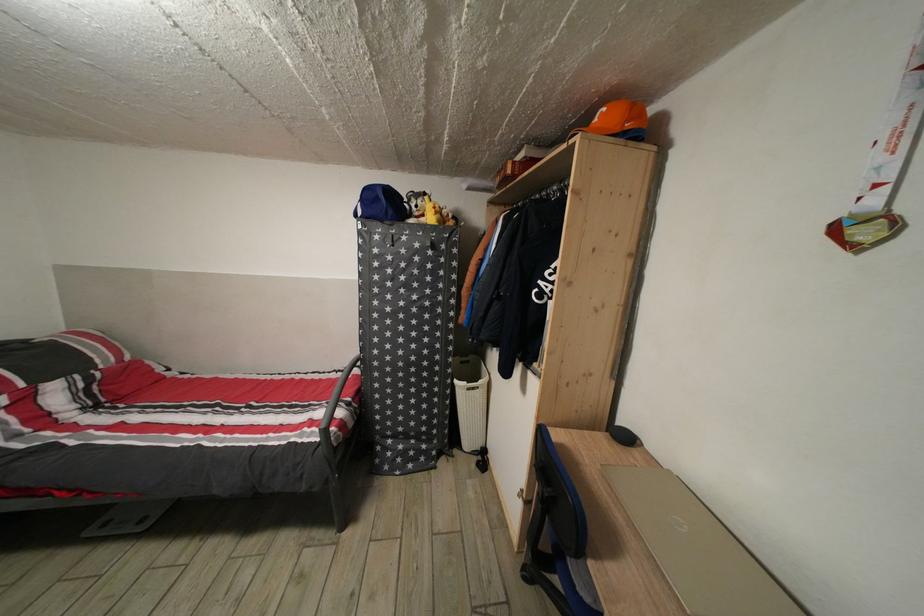
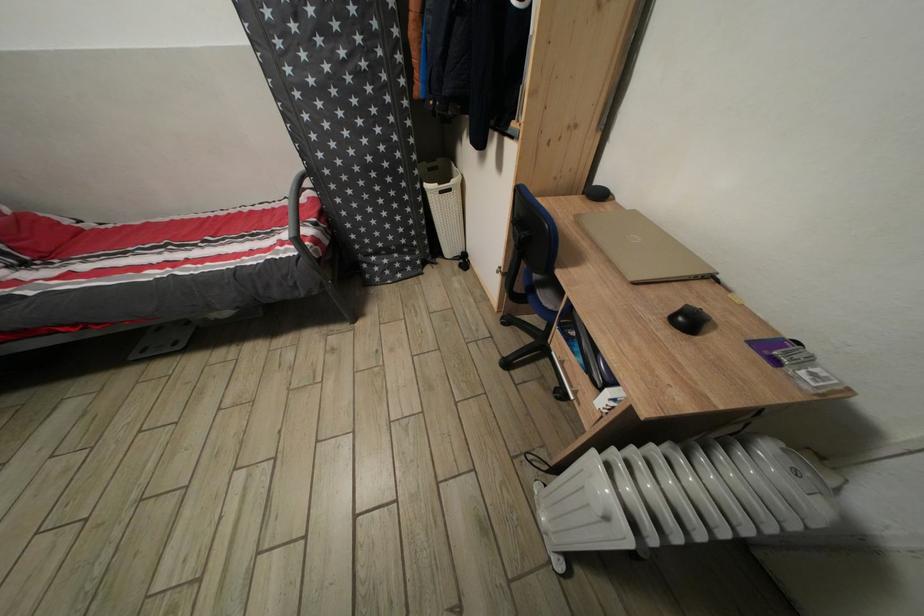
Find the pixel in the second image that matches pixel 395 387 in the first image.

(357, 198)